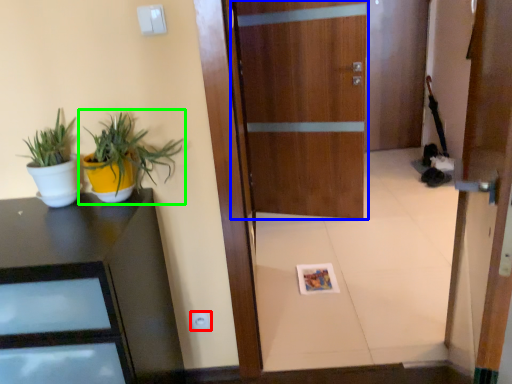
Question: Which is farther away from electric outlet (highlighted by a red box)? door (highlighted by a blue box) or houseplant (highlighted by a green box)?

Choices:
 (A) door
 (B) houseplant

Answer: (A)